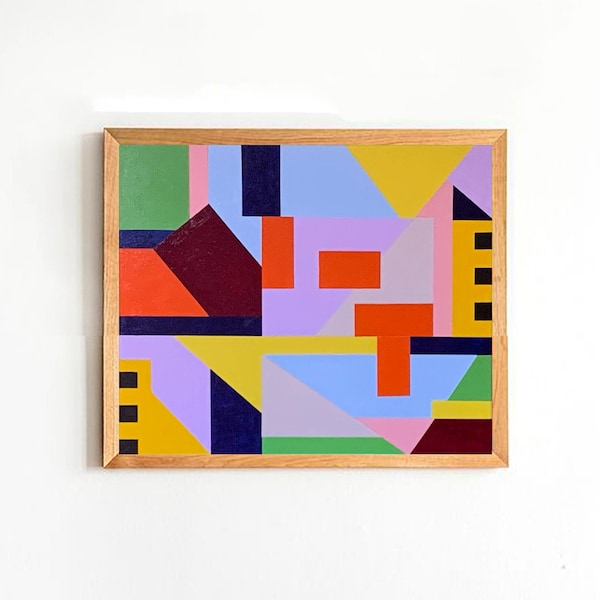
At what (x,y) coordinates should I click in order to perform the action: click on bottom lefttmost corner of wooden frame. Please return your answer as a coordinate pair (x, y). Looking at the image, I should click on (103, 465).